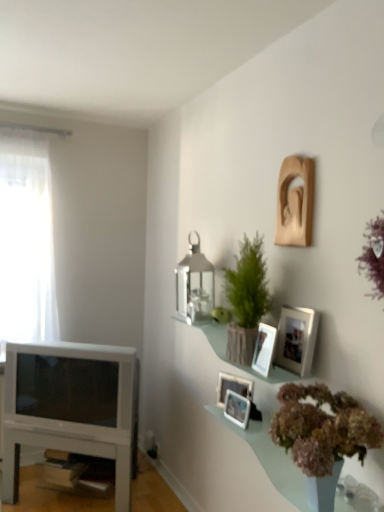
Question: Is matte silver picture frame at center, which is counted as the second picture frame, starting from the bottom, not within matte silver picture frame at center, positioned as the 5th picture frame in top-to-bottom order?

Choices:
 (A) yes
 (B) no

Answer: (A)

Question: Is matte silver picture frame at center, which ranks as the 4th picture frame in top-to-bottom order, bigger than matte silver picture frame at center, marked as the 1th picture frame in a bottom-to-top arrangement?

Choices:
 (A) no
 (B) yes

Answer: (B)

Question: Does matte silver picture frame at center, which ranks as the 4th picture frame in top-to-bottom order, lie behind matte silver picture frame at center, marked as the 1th picture frame in a bottom-to-top arrangement?

Choices:
 (A) no
 (B) yes

Answer: (B)

Question: Does matte silver picture frame at center, which ranks as the 4th picture frame in top-to-bottom order, have a greater height compared to matte silver picture frame at center, positioned as the 5th picture frame in top-to-bottom order?

Choices:
 (A) no
 (B) yes

Answer: (B)

Question: Can you confirm if matte silver picture frame at center, which ranks as the 4th picture frame in top-to-bottom order, is thinner than matte silver picture frame at center, marked as the 1th picture frame in a bottom-to-top arrangement?

Choices:
 (A) no
 (B) yes

Answer: (A)

Question: From a real-world perspective, is white glossy television at left positioned above or below white glossy table at lower left?

Choices:
 (A) below
 (B) above

Answer: (B)

Question: In the image, is white glossy television at left positioned in front of or behind white glossy table at lower left?

Choices:
 (A) behind
 (B) front

Answer: (B)

Question: Would you say white glossy television at left is to the left or to the right of white glossy table at lower left in the picture?

Choices:
 (A) left
 (B) right

Answer: (B)

Question: Is white glossy television at left wider or thinner than white glossy table at lower left?

Choices:
 (A) thin
 (B) wide

Answer: (A)

Question: From a real-world perspective, is wooden photo frame at upper right, the second picture frame in the top-to-bottom sequence, physically located above or below green matte plant at upper right, which appears as the 2th houseplant when viewed from the top?

Choices:
 (A) above
 (B) below

Answer: (A)

Question: In terms of height, does wooden photo frame at upper right, arranged as the fourth picture frame when ordered from the bottom, look taller or shorter compared to green matte plant at upper right, which appears as the 2th houseplant when viewed from the top?

Choices:
 (A) tall
 (B) short

Answer: (B)

Question: Does point (283, 329) appear closer or farther from the camera than point (340, 457)?

Choices:
 (A) farther
 (B) closer

Answer: (A)

Question: Looking at their shapes, would you say wooden photo frame at upper right, arranged as the fourth picture frame when ordered from the bottom, is wider or thinner than green matte plant at upper right, the 2th houseplant positioned from the back?

Choices:
 (A) thin
 (B) wide

Answer: (A)

Question: Considering the positions of point (19, 359) and point (291, 190), is point (19, 359) closer or farther from the camera than point (291, 190)?

Choices:
 (A) farther
 (B) closer

Answer: (A)

Question: From their relative heights in the image, would you say white glossy television at left is taller or shorter than wooden sculpture at upper right, the 1th picture frame in the top-to-bottom sequence?

Choices:
 (A) short
 (B) tall

Answer: (B)